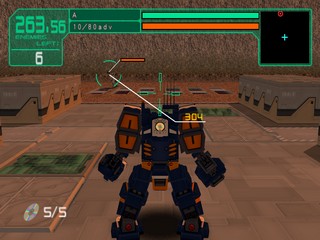
You are a GUI agent. You are given a task and a screenshot of the screen. Output one action in this format:
    pyautogui.click(x=<x>, y=<y>)
    Task: Click on the floor
    
    Given the screenshot: What is the action you would take?
    pyautogui.click(x=269, y=168)